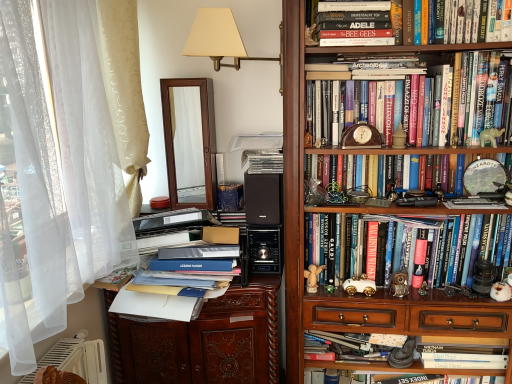
Question: Is wooden carved file cabinet at center spatially inside wooden bookshelf at upper right, or outside of it?

Choices:
 (A) outside
 (B) inside

Answer: (A)

Question: From the image's perspective, relative to wooden bookshelf at upper right, is wooden carved file cabinet at center above or below?

Choices:
 (A) above
 (B) below

Answer: (B)

Question: Estimate the real-world distances between objects in this image. Which object is closer to the white glossy toy car at center, which appears as the 2th toy when viewed from the left?

Choices:
 (A) green plastic elephant at upper right, positioned as the first toy in top-to-bottom order
 (B) hardcover book at center, which appears as the fourth book when ordered from the bottom
 (C) wooden bookshelf at upper right
 (D) blue matte book at center, which is the 2th paperback book in bottom-to-top order
 (E) wooden carved file cabinet at center

Answer: (C)

Question: Which object is positioned closest to the beige fabric lampshade at upper center?

Choices:
 (A) hardcover book at center, which appears as the fourth book when ordered from the bottom
 (B) hardcover book at center, which is counted as the first book, starting from the bottom
 (C) hardcover book at upper center, the 2th book positioned from the top
 (D) hardcover book at upper center, placed as the 1th book when sorted from top to bottom
 (E) green plastic elephant at upper right, positioned as the first toy in top-to-bottom order

Answer: (C)